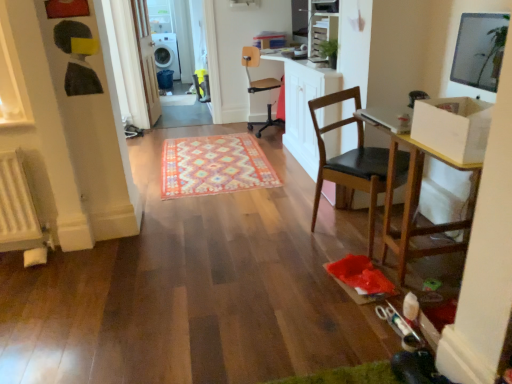
You are a GUI agent. You are given a task and a screenshot of the screen. Output one action in this format:
    pyautogui.click(x=<x>, y=<y>)
    Task: Click on the free point above multicolored woven rug at center (from a real-world perspective)
    The width and height of the screenshot is (512, 384).
    Given the screenshot: What is the action you would take?
    coord(204,160)